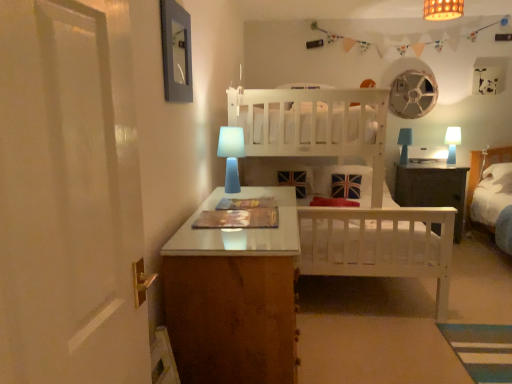
Question: Should I look upward or downward to see white wooden bed at center?

Choices:
 (A) down
 (B) up

Answer: (B)

Question: Does white wooden bed at center lie behind blue matte table lamp at center, the 1th table lamp in the front-to-back sequence?

Choices:
 (A) yes
 (B) no

Answer: (A)

Question: Is white wooden bed at center bigger than blue matte table lamp at center, the third table lamp when ordered from back to front?

Choices:
 (A) yes
 (B) no

Answer: (A)

Question: Is white wooden bed at center facing away from blue matte table lamp at center, the third table lamp when ordered from back to front?

Choices:
 (A) yes
 (B) no

Answer: (B)

Question: From the image's perspective, would you say white wooden bed at center is shown under blue matte table lamp at center, the 1th table lamp in the front-to-back sequence?

Choices:
 (A) yes
 (B) no

Answer: (A)

Question: Is white wooden bed at center positioned beyond the bounds of blue matte table lamp at center, which appears as the first table lamp when viewed from the left?

Choices:
 (A) no
 (B) yes

Answer: (B)

Question: Could you tell me if white wooden bed at center is facing blue matte table lamp at center, acting as the 3th table lamp starting from the right?

Choices:
 (A) yes
 (B) no

Answer: (A)

Question: Considering the relative sizes of blue matte table lamp at center, the third table lamp when ordered from back to front, and dark wood nightstand at center in the image provided, is blue matte table lamp at center, the third table lamp when ordered from back to front, smaller than dark wood nightstand at center?

Choices:
 (A) no
 (B) yes

Answer: (B)

Question: Is blue matte table lamp at center, the third table lamp when ordered from back to front, touching dark wood nightstand at center?

Choices:
 (A) yes
 (B) no

Answer: (B)

Question: Is blue matte table lamp at center, acting as the 3th table lamp starting from the right, aimed at dark wood nightstand at center?

Choices:
 (A) yes
 (B) no

Answer: (B)

Question: Does blue matte table lamp at center, the third table lamp when ordered from back to front, lie behind dark wood nightstand at center?

Choices:
 (A) yes
 (B) no

Answer: (B)

Question: Is dark wood nightstand at center a part of blue matte table lamp at center, which appears as the first table lamp when viewed from the left?

Choices:
 (A) no
 (B) yes

Answer: (A)

Question: From a real-world perspective, is blue matte table lamp at center, acting as the 3th table lamp starting from the right, positioned over dark wood nightstand at center based on gravity?

Choices:
 (A) no
 (B) yes

Answer: (B)

Question: Is the position of blue matte table lamp at right, which is counted as the 2th table lamp, starting from the left, more distant than that of bamboo lampshade at upper center?

Choices:
 (A) no
 (B) yes

Answer: (B)